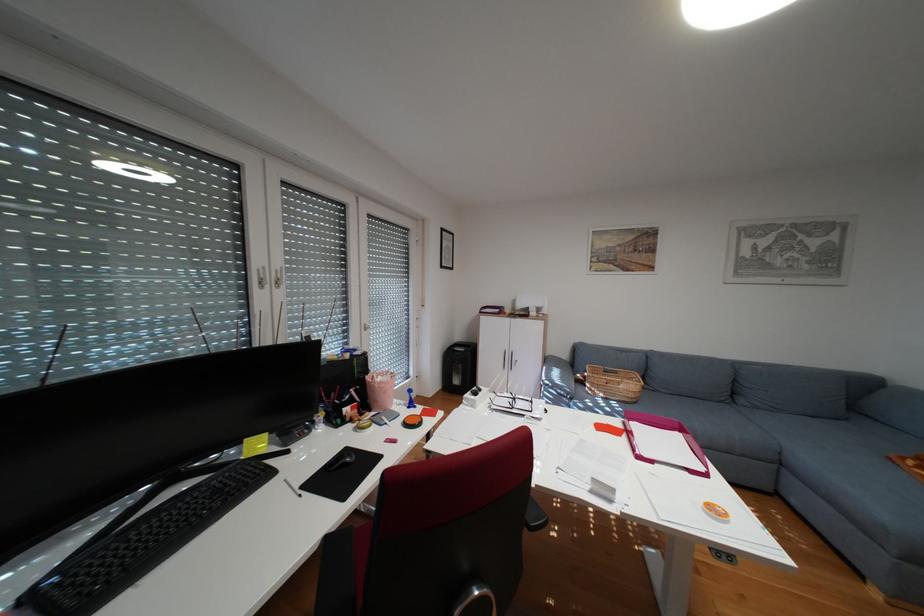
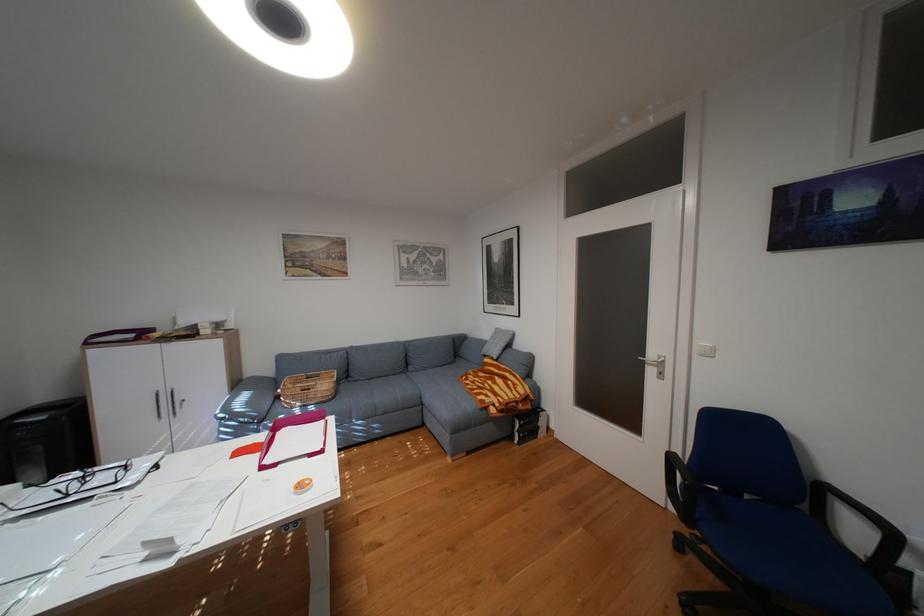
Find the pixel in the second image that matches (x=532, y=403) in the first image.

(114, 477)